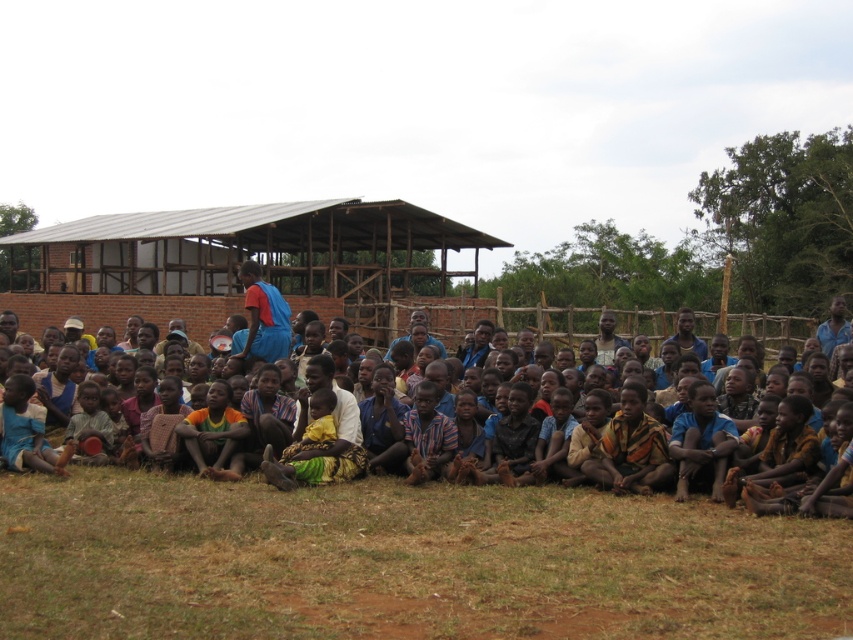
You are standing in the grassy area in front of the brick structure and want to walk from point (338,225) to point (13,292). Which direction should you move to get closer to your destination?

To move from point (338,225) to point (13,292), you should move downward because point (13,292) is lower on the image compared to point (338,225).

You are a photographer trying to capture a group shot of the children. You notice the brown textured cloth at center and the blue fabric shirt at center. Which object should you adjust to ensure both are fully visible in the frame?

The brown textured cloth at center is taller than the blue fabric shirt at center. To ensure both are fully visible, you should lower the angle of the camera or adjust the framing to accommodate the taller brown textured cloth at center.

You are organizing a community event and need to cover a table with the brown textured cloth at center and the blue fabric shirt at center. Which item would you choose to ensure the table is fully covered?

The brown textured cloth at center has a larger width than the blue fabric shirt at center, so it would be the better choice to fully cover the table.